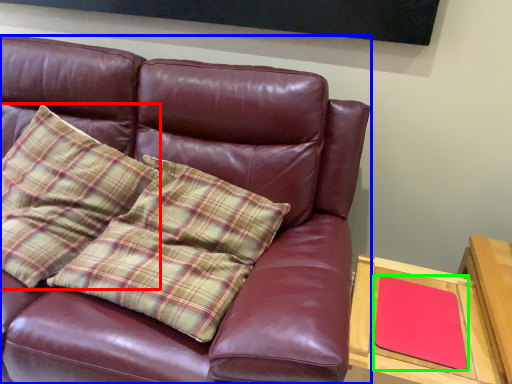
Question: Which object is the closest to the pillow (highlighted by a red box)? Choose among these: studio couch (highlighted by a blue box) or pad (highlighted by a green box).

Choices:
 (A) studio couch
 (B) pad

Answer: (A)